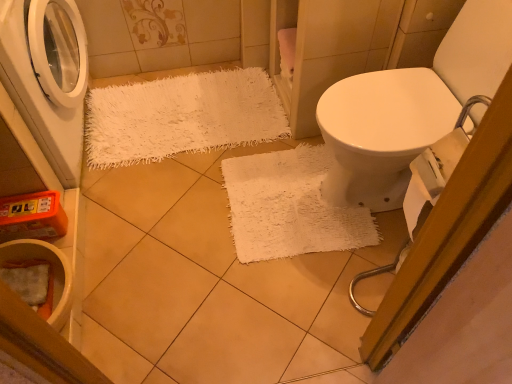
Question: Considering the relative sizes of white shaggy rug at upper left and white matte washing machine at left in the image provided, is white shaggy rug at upper left thinner than white matte washing machine at left?

Choices:
 (A) yes
 (B) no

Answer: (B)

Question: Does white shaggy rug at upper left touch white matte washing machine at left?

Choices:
 (A) no
 (B) yes

Answer: (A)

Question: Would you say white shaggy rug at upper left is outside white matte washing machine at left?

Choices:
 (A) no
 (B) yes

Answer: (B)

Question: Is white shaggy rug at upper left turned away from white matte washing machine at left?

Choices:
 (A) no
 (B) yes

Answer: (A)

Question: From the image's perspective, does white shaggy rug at upper left appear lower than white matte washing machine at left?

Choices:
 (A) no
 (B) yes

Answer: (B)

Question: Is white shaggy rug at upper left behind white matte washing machine at left?

Choices:
 (A) no
 (B) yes

Answer: (B)

Question: Is white shaggy rug at upper left at the right side of white ceramic toilet bowl at lower left?

Choices:
 (A) yes
 (B) no

Answer: (A)

Question: Is white shaggy rug at upper left positioned with its back to white ceramic toilet bowl at lower left?

Choices:
 (A) no
 (B) yes

Answer: (A)

Question: Is there a large distance between white shaggy rug at upper left and white ceramic toilet bowl at lower left?

Choices:
 (A) no
 (B) yes

Answer: (A)

Question: Is white shaggy rug at upper left shorter than white ceramic toilet bowl at lower left?

Choices:
 (A) no
 (B) yes

Answer: (B)

Question: Is white shaggy rug at upper left next to white ceramic toilet bowl at lower left?

Choices:
 (A) no
 (B) yes

Answer: (A)

Question: Could you tell me if white shaggy rug at upper left is turned towards white ceramic toilet bowl at lower left?

Choices:
 (A) yes
 (B) no

Answer: (B)

Question: Does white ceramic toilet bowl at lower left have a lesser height compared to white matte washing machine at left?

Choices:
 (A) yes
 (B) no

Answer: (A)